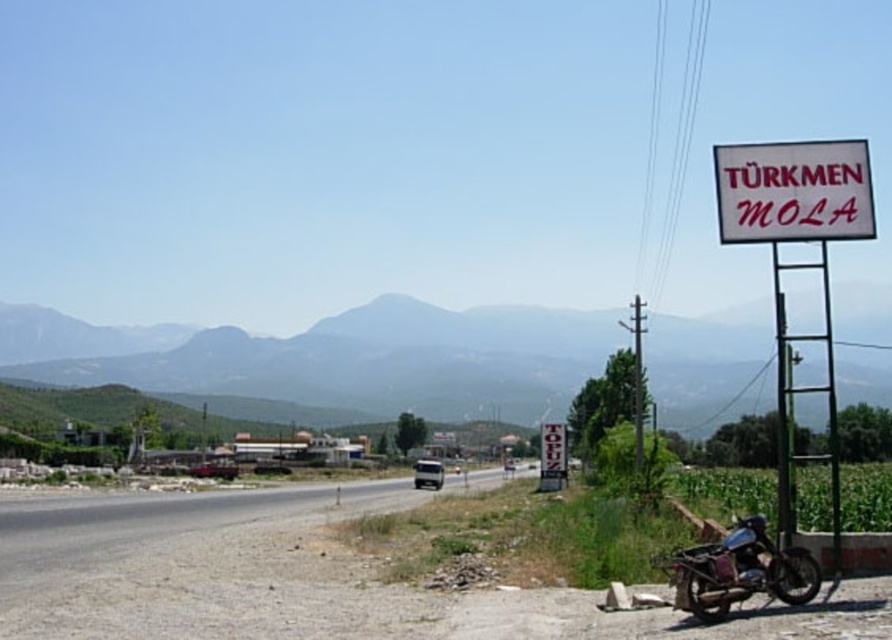
Which is behind, point (838, 525) or point (791, 157)?

The point (838, 525) is behind.

Who is more forward, (839,563) or (748,209)?

Positioned in front is point (748,209).

Where is `white plastic sign at right`? white plastic sign at right is located at coordinates pyautogui.click(x=797, y=262).

Can you confirm if green grassy mountain at upper center is thinner than white plastic sign at right?

Incorrect, green grassy mountain at upper center's width is not less than white plastic sign at right's.

Which of these two, green grassy mountain at upper center or white plastic sign at right, stands shorter?

white plastic sign at right is shorter.

Is point (554, 332) closer to viewer compared to point (781, 486)?

That is False.

Find the location of `green grassy mountain at upper center`. green grassy mountain at upper center is located at coordinates (334, 356).

In the scene shown: Who is more forward, (862, 337) or (723, 570)?

Point (723, 570)

From the picture: Is green grassy mountain at upper center to the left of metallic brown motorbike at lower right from the viewer's perspective?

Correct, you'll find green grassy mountain at upper center to the left of metallic brown motorbike at lower right.

The image size is (892, 640). Identify the location of green grassy mountain at upper center. (x=334, y=356).